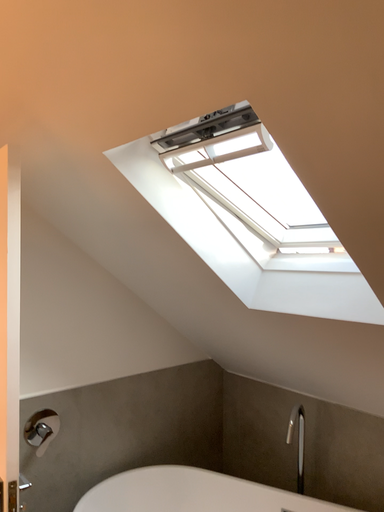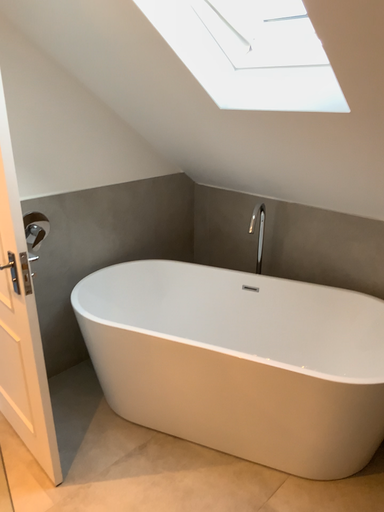
Question: How did the camera likely rotate when shooting the video?

Choices:
 (A) rotated downward
 (B) rotated upward

Answer: (A)